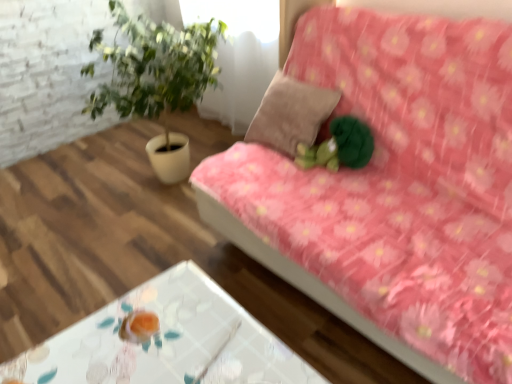
The image size is (512, 384). In order to click on suede-like beige pillow at center in this screenshot , I will do (291, 114).

Find the location of a particular element. The width and height of the screenshot is (512, 384). pink floral fabric couch at upper right is located at coordinates (397, 188).

The width and height of the screenshot is (512, 384). What do you see at coordinates (165, 342) in the screenshot?
I see `transparent glass table at lower center` at bounding box center [165, 342].

The width and height of the screenshot is (512, 384). Identify the location of suede-like beige pillow at center. (291, 114).

Which is in front, suede-like beige pillow at center or pink floral fabric couch at upper right?

pink floral fabric couch at upper right is more forward.

Is point (312, 128) farther from camera compared to point (218, 175)?

That is True.

How much distance is there between suede-like beige pillow at center and pink floral fabric couch at upper right?

The distance of suede-like beige pillow at center from pink floral fabric couch at upper right is 12.09 inches.

Image resolution: width=512 pixels, height=384 pixels. What are the coordinates of `pillow behind the pink floral fabric couch at upper right` in the screenshot? It's located at (291, 114).

From the image's perspective, is pink floral fabric couch at upper right above or below transparent glass table at lower center?

pink floral fabric couch at upper right is situated higher than transparent glass table at lower center in the image.

In the scene shown: How many degrees apart are the facing directions of pink floral fabric couch at upper right and transparent glass table at lower center?

There is a 90-degree angle between the facing directions of pink floral fabric couch at upper right and transparent glass table at lower center.

Would you say pink floral fabric couch at upper right is outside transparent glass table at lower center?

Indeed, pink floral fabric couch at upper right is completely outside transparent glass table at lower center.

Which object is further away from the camera, pink floral fabric couch at upper right or transparent glass table at lower center?

transparent glass table at lower center is behind.

In the scene shown: How many degrees apart are the facing directions of pink floral fabric couch at upper right and green plush toy at center?

There is a 4.35-degree angle between the facing directions of pink floral fabric couch at upper right and green plush toy at center.

Which is behind, point (413, 108) or point (343, 151)?

Point (343, 151)

Is pink floral fabric couch at upper right located outside green plush toy at center?

That's correct, pink floral fabric couch at upper right is outside of green plush toy at center.

Is pink floral fabric couch at upper right turned away from green plush toy at center?

Yes, green plush toy at center is at the back of pink floral fabric couch at upper right.

Considering the sizes of objects transparent glass table at lower center and suede-like beige pillow at center in the image provided, who is taller, transparent glass table at lower center or suede-like beige pillow at center?

Standing taller between the two is transparent glass table at lower center.

Are transparent glass table at lower center and suede-like beige pillow at center beside each other?

No, transparent glass table at lower center is not touching suede-like beige pillow at center.

Does transparent glass table at lower center come in front of suede-like beige pillow at center?

Yes, it is.

How different are the orientations of transparent glass table at lower center and suede-like beige pillow at center in degrees?

The facing directions of transparent glass table at lower center and suede-like beige pillow at center are 90 degrees apart.

Is green plush toy at center wider or thinner than suede-like beige pillow at center?

Considering their sizes, green plush toy at center looks slimmer than suede-like beige pillow at center.

How much distance is there between green plush toy at center and suede-like beige pillow at center?

green plush toy at center is 15.21 centimeters from suede-like beige pillow at center.

Is green plush toy at center situated inside suede-like beige pillow at center or outside?

green plush toy at center is not enclosed by suede-like beige pillow at center.

Between green plush toy at center and suede-like beige pillow at center, which one has smaller size?

green plush toy at center is smaller.

Between transparent glass table at lower center and green plush toy at center, which one has more height?

transparent glass table at lower center.

Identify the location of toy above the transparent glass table at lower center (from the image's perspective). The height and width of the screenshot is (384, 512). (339, 146).

Does transparent glass table at lower center appear on the left side of green plush toy at center?

Yes, transparent glass table at lower center is to the left of green plush toy at center.

Is suede-like beige pillow at center closer to camera compared to transparent glass table at lower center?

No, suede-like beige pillow at center is further to the viewer.

In terms of size, does suede-like beige pillow at center appear bigger or smaller than transparent glass table at lower center?

In the image, suede-like beige pillow at center appears to be smaller than transparent glass table at lower center.

From their relative heights in the image, would you say suede-like beige pillow at center is taller or shorter than transparent glass table at lower center?

suede-like beige pillow at center is shorter than transparent glass table at lower center.

Could transparent glass table at lower center be considered to be inside suede-like beige pillow at center?

No.

Locate an element on the screen. This screenshot has width=512, height=384. pillow located on the left of pink floral fabric couch at upper right is located at coordinates (291, 114).

Where is `table lying below the pink floral fabric couch at upper right (from the image's perspective)`? The height and width of the screenshot is (384, 512). table lying below the pink floral fabric couch at upper right (from the image's perspective) is located at coordinates (165, 342).

Estimate the real-world distances between objects in this image. Which object is closer to pink floral fabric couch at upper right, suede-like beige pillow at center or transparent glass table at lower center?

suede-like beige pillow at center is closer to pink floral fabric couch at upper right.

When comparing their distances from green plush toy at center, does suede-like beige pillow at center or transparent glass table at lower center seem further?

Based on the image, transparent glass table at lower center appears to be further to green plush toy at center.

Estimate the real-world distances between objects in this image. Which object is closer to pink floral fabric couch at upper right, suede-like beige pillow at center or green plush toy at center?

Among the two, green plush toy at center is located nearer to pink floral fabric couch at upper right.

Looking at the image, which one is located further to green plush toy at center, pink floral fabric couch at upper right or suede-like beige pillow at center?

pink floral fabric couch at upper right is further to green plush toy at center.

From the image, which object appears to be farther from pink floral fabric couch at upper right, green plush toy at center or transparent glass table at lower center?

transparent glass table at lower center.

Considering their positions, is green plush toy at center positioned further to suede-like beige pillow at center than pink floral fabric couch at upper right?

pink floral fabric couch at upper right.

Which object lies further to the anchor point transparent glass table at lower center, green plush toy at center or pink floral fabric couch at upper right?

Based on the image, green plush toy at center appears to be further to transparent glass table at lower center.

Based on the photo, based on their spatial positions, is pink floral fabric couch at upper right or transparent glass table at lower center further from green plush toy at center?

transparent glass table at lower center.

Identify the location of table between pink floral fabric couch at upper right and green plush toy at center along the z-axis. This screenshot has width=512, height=384. (165, 342).

Where is `toy located between transparent glass table at lower center and suede-like beige pillow at center in the depth direction`? The width and height of the screenshot is (512, 384). toy located between transparent glass table at lower center and suede-like beige pillow at center in the depth direction is located at coordinates coord(339,146).

Where is `table between pink floral fabric couch at upper right and suede-like beige pillow at center along the z-axis`? The height and width of the screenshot is (384, 512). table between pink floral fabric couch at upper right and suede-like beige pillow at center along the z-axis is located at coordinates (165, 342).

You are a GUI agent. You are given a task and a screenshot of the screen. Output one action in this format:
    pyautogui.click(x=<x>, y=<y>)
    Task: Click on the toy located between pink floral fabric couch at upper right and suede-like beige pillow at center in the depth direction
    
    Given the screenshot: What is the action you would take?
    pyautogui.click(x=339, y=146)